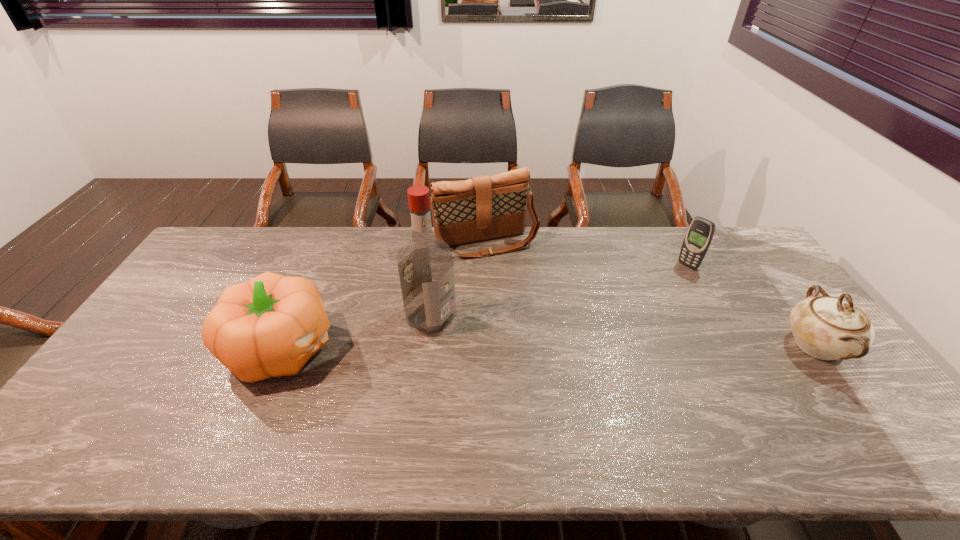
This screenshot has width=960, height=540. Identify the location of the leftmost object. coord(270,326).

This screenshot has height=540, width=960. In order to click on the rightmost object in this screenshot , I will do `click(827, 328)`.

The width and height of the screenshot is (960, 540). Identify the location of the tallest object. (425, 263).

Where is `shoulder bag`? shoulder bag is located at coordinates (481, 208).

Where is `cellular telephone`? This screenshot has height=540, width=960. cellular telephone is located at coordinates (700, 232).

The height and width of the screenshot is (540, 960). In order to click on free spot located on the carved face of the leftmost object in this screenshot , I will do `click(428, 348)`.

Locate an element on the screen. free space located on the left of the chinaware is located at coordinates (642, 346).

Locate an element on the screen. This screenshot has height=540, width=960. free space located on the front-facing side of the tallest object is located at coordinates (557, 378).

Find the location of a particular element. The image size is (960, 540). vacant space located on the front-facing side of the tallest object is located at coordinates (540, 369).

Where is `vacant space positioned on the front-facing side of the tallest object`? This screenshot has height=540, width=960. vacant space positioned on the front-facing side of the tallest object is located at coordinates (571, 384).